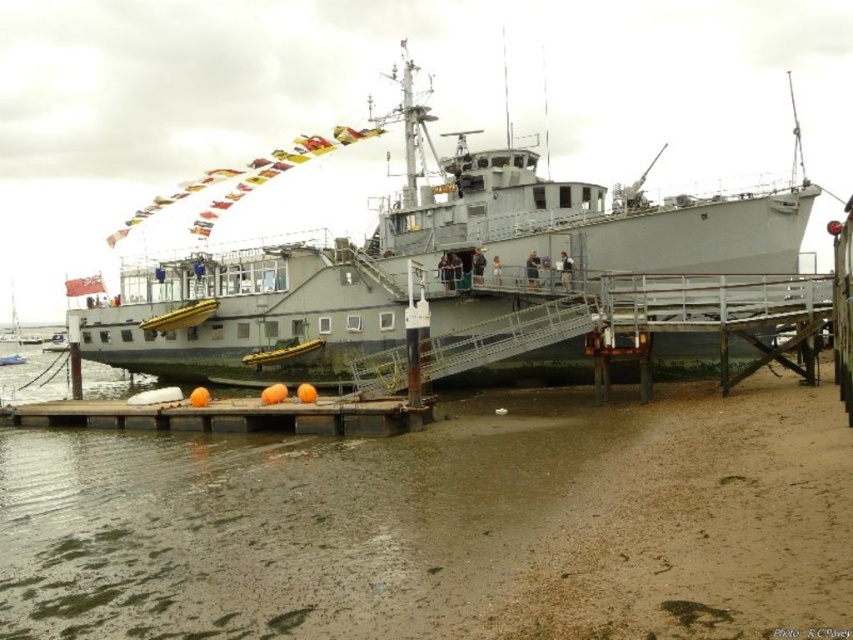
Question: Which of the following is the farthest from the observer?

Choices:
 (A) (785, 204)
 (B) (347, 403)

Answer: (A)

Question: Considering the real-world distances, which object is farthest from the smooth wooden dock at lower center?

Choices:
 (A) gray matte boat at center
 (B) brown sand at lower right

Answer: (A)

Question: Is brown sand at lower right positioned before smooth wooden dock at lower center?

Choices:
 (A) yes
 (B) no

Answer: (A)

Question: Which of these objects is positioned farthest from the smooth wooden dock at lower center?

Choices:
 (A) brown sand at lower right
 (B) gray matte boat at center

Answer: (B)

Question: Does brown sand at lower right have a smaller size compared to gray matte boat at center?

Choices:
 (A) yes
 (B) no

Answer: (A)

Question: Is brown sand at lower right to the left of smooth wooden dock at lower center from the viewer's perspective?

Choices:
 (A) yes
 (B) no

Answer: (B)